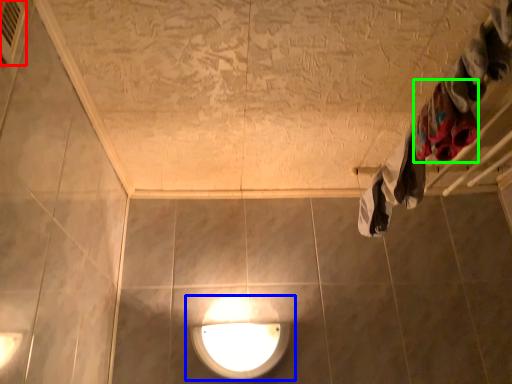
Question: Estimate the real-world distances between objects in this image. Which object is farther from air conditioner (highlighted by a red box), lamp (highlighted by a blue box) or clothing (highlighted by a green box)?

Choices:
 (A) lamp
 (B) clothing

Answer: (A)